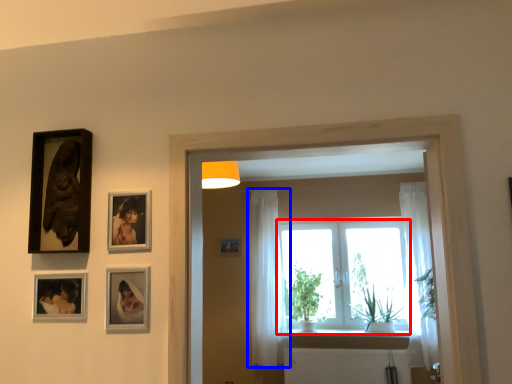
Question: Among these objects, which one is farthest to the camera, window (highlighted by a red box) or curtain (highlighted by a blue box)?

Choices:
 (A) window
 (B) curtain

Answer: (A)